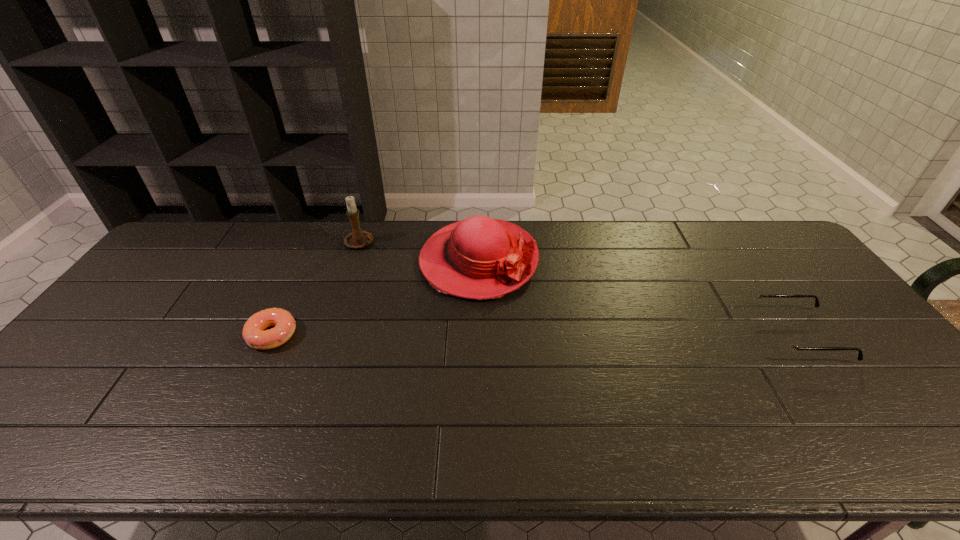
Find the location of `the shortest object`. the shortest object is located at coordinates (253, 332).

I want to click on the leftmost object, so click(253, 332).

You are a GUI agent. You are given a task and a screenshot of the screen. Output one action in this format:
    pyautogui.click(x=<x>, y=<y>)
    Task: Click on the rightmost object
    
    Given the screenshot: What is the action you would take?
    pyautogui.click(x=783, y=342)

You are a GUI agent. You are given a task and a screenshot of the screen. Output one action in this format:
    pyautogui.click(x=<x>, y=<y>)
    Task: Click on the spectacles
    This screenshot has width=960, height=540.
    Given the screenshot: What is the action you would take?
    pyautogui.click(x=783, y=342)

The image size is (960, 540). I want to click on the second tallest object, so click(479, 258).

Identify the location of hat. The image size is (960, 540). (479, 258).

This screenshot has height=540, width=960. I want to click on the tallest object, so click(x=357, y=239).

Image resolution: width=960 pixels, height=540 pixels. In order to click on candle holder in this screenshot , I will do `click(357, 239)`.

Where is `free spot located 0.150m on the right of the shortest object`? free spot located 0.150m on the right of the shortest object is located at coordinates (x=351, y=335).

Where is `vacant region located at the hinge ends of the spectacles`? vacant region located at the hinge ends of the spectacles is located at coordinates (660, 335).